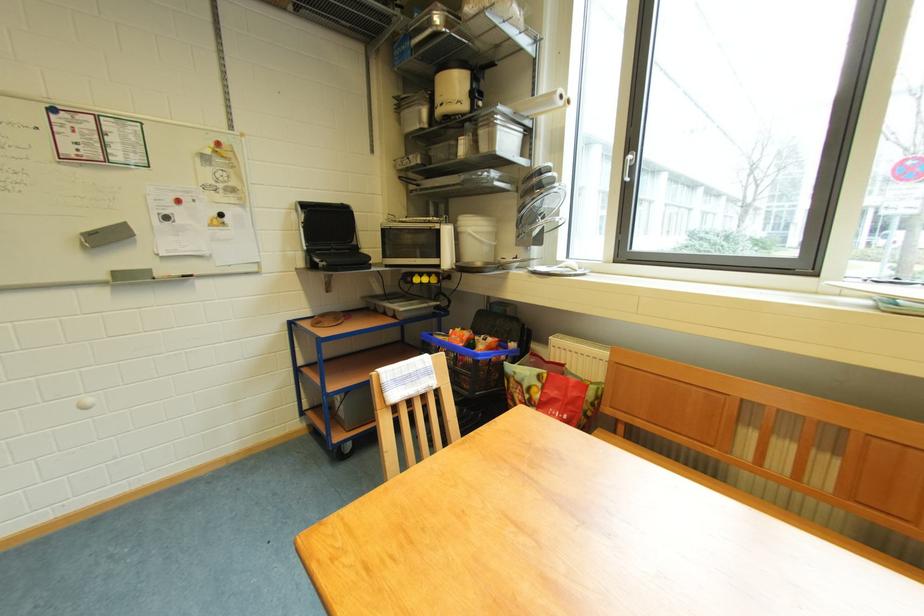
Describe the element at coordinates (627, 166) in the screenshot. Image resolution: width=924 pixels, height=616 pixels. I see `the white window handle` at that location.